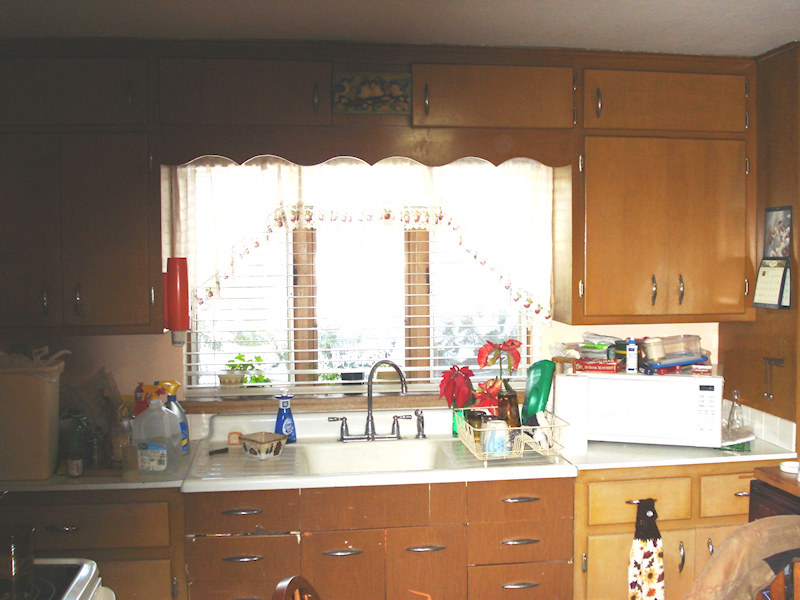
Locate an element on the screen. This screenshot has height=600, width=800. button on dish towel bottom right is located at coordinates (649, 512).